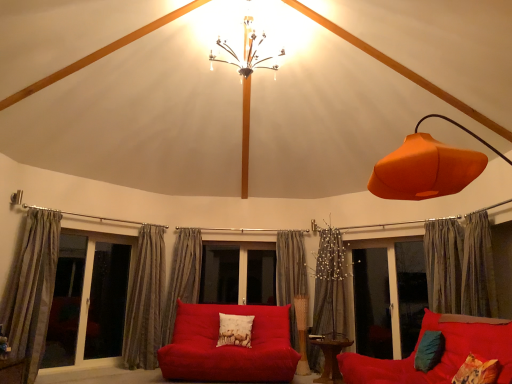
Question: Do you think white glass screen door at left, which appears as the first screen door when viewed from the left, is within wooden table at center, or outside of it?

Choices:
 (A) outside
 (B) inside

Answer: (A)

Question: From their relative heights in the image, would you say white glass screen door at left, the second screen door from the right, is taller or shorter than wooden table at center?

Choices:
 (A) tall
 (B) short

Answer: (A)

Question: Which of these objects is positioned farthest from the transparent glass screen door at center, positioned as the second screen door in left-to-right order?

Choices:
 (A) matte glass window at left
 (B) silky gray curtain at center, the 2th curtain viewed from the right
 (C) metallic chandelier at upper center
 (D) white glass screen door at left, which appears as the first screen door when viewed from the left
 (E) transparent glass window at center

Answer: (A)

Question: Based on their relative distances, which object is nearer to the striped fabric curtain at center, the third curtain from the left?

Choices:
 (A) silky gray curtain at center, the 2th curtain viewed from the right
 (B) white cotton pillow with animal print at center, which is the 3th pillow in right-to-left order
 (C) silky gray curtain at right, which appears as the first curtain when viewed from the right
 (D) teal fabric pillow at lower right, which ranks as the second pillow in left-to-right order
 (E) metallic chandelier at upper center

Answer: (B)